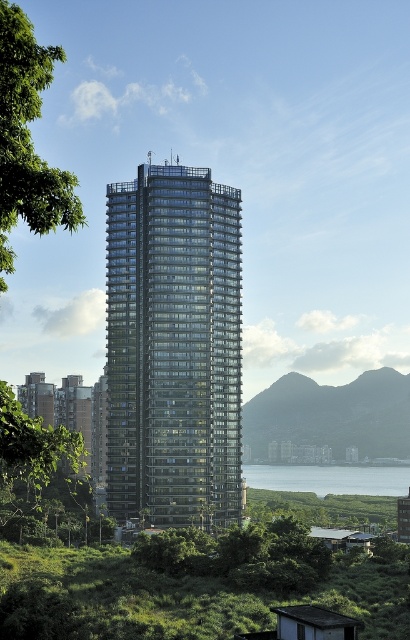
Question: Can you confirm if green leafy tree at upper left is positioned to the left of blue glass water at lower center?

Choices:
 (A) yes
 (B) no

Answer: (A)

Question: Which object is the farthest from the rocky gray hillside at center?

Choices:
 (A) green leafy tree at upper left
 (B) transparent glass building at center

Answer: (A)

Question: From the image, what is the correct spatial relationship of green leafy tree at upper left in relation to rocky gray hillside at center?

Choices:
 (A) above
 (B) below

Answer: (A)

Question: Which object is the closest to the blue glass water at lower center?

Choices:
 (A) rocky gray hillside at center
 (B) transparent glass building at center
 (C) green leafy tree at upper left

Answer: (A)

Question: Is the position of transparent glass building at center less distant than that of blue glass water at lower center?

Choices:
 (A) yes
 (B) no

Answer: (A)

Question: Which of these objects is positioned closest to the rocky gray hillside at center?

Choices:
 (A) transparent glass building at center
 (B) green leafy tree at upper left
 (C) blue glass water at lower center

Answer: (C)